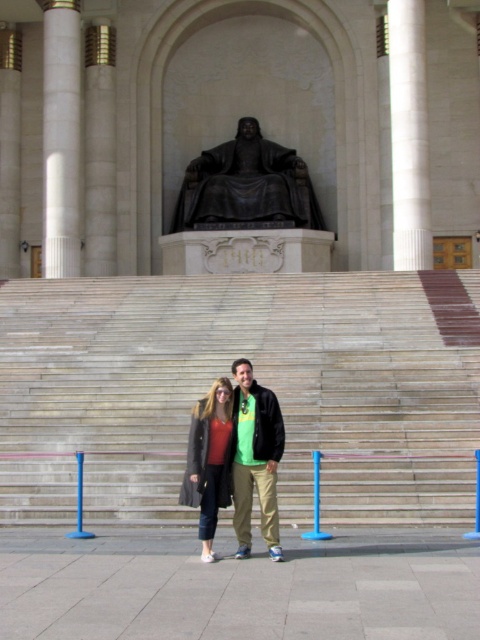
Question: Which point is farther to the camera?

Choices:
 (A) white marble pillar at right
 (B) matte gray coat at center

Answer: (A)

Question: Observing the image, what is the correct spatial positioning of white marble column at left in reference to green fabric shirt at center?

Choices:
 (A) right
 (B) left

Answer: (B)

Question: Does bronze statue at center have a greater width compared to green fabric shirt at center?

Choices:
 (A) no
 (B) yes

Answer: (B)

Question: Which is nearer to the green fabric shirt at center?

Choices:
 (A) bronze statue at center
 (B) white marble column at left

Answer: (B)

Question: Which is farther from the white marble column at left?

Choices:
 (A) green fabric shirt at center
 (B) smooth stone stairs at center
 (C) bronze statue at center
 (D) white marble pillar at right

Answer: (A)

Question: Where is green fabric shirt at center located in relation to matte gray coat at center in the image?

Choices:
 (A) above
 (B) below

Answer: (A)